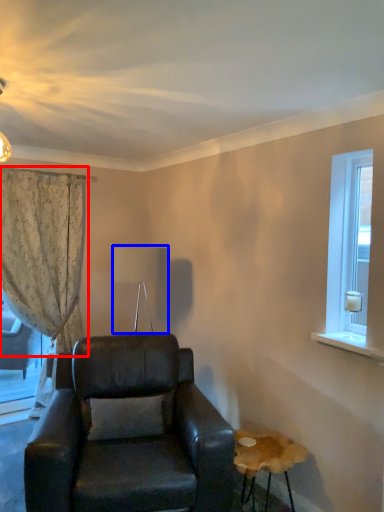
Question: Which object appears closest to the camera in this image, curtain (highlighted by a red box) or lamp (highlighted by a blue box)?

Choices:
 (A) curtain
 (B) lamp

Answer: (B)